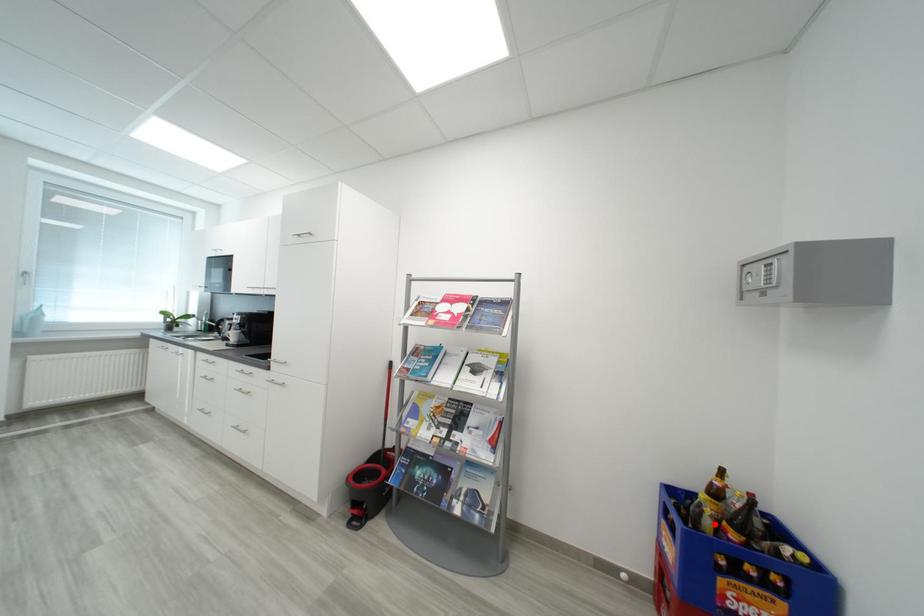
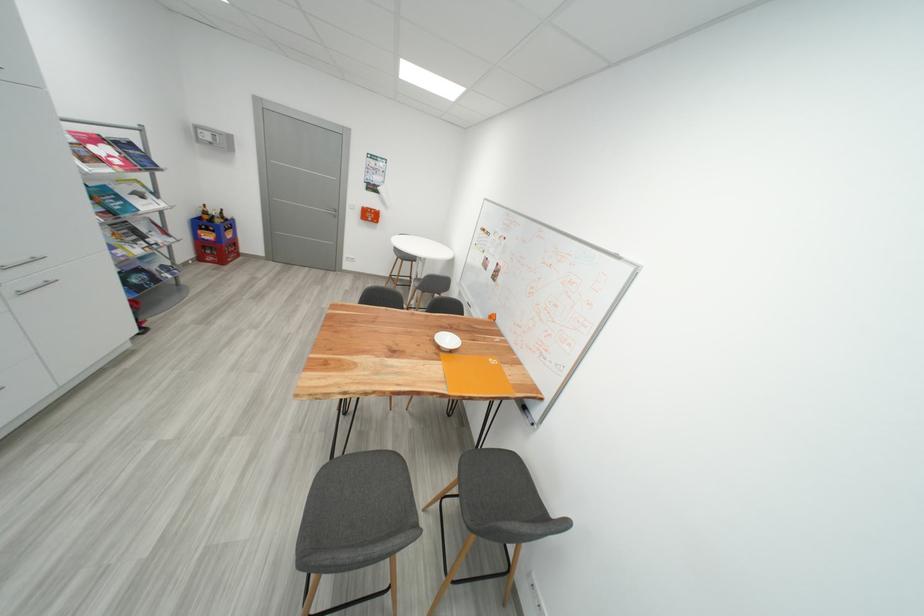
Where in the second image is the point corresponding to the highlighted location from the first image?

(225, 223)